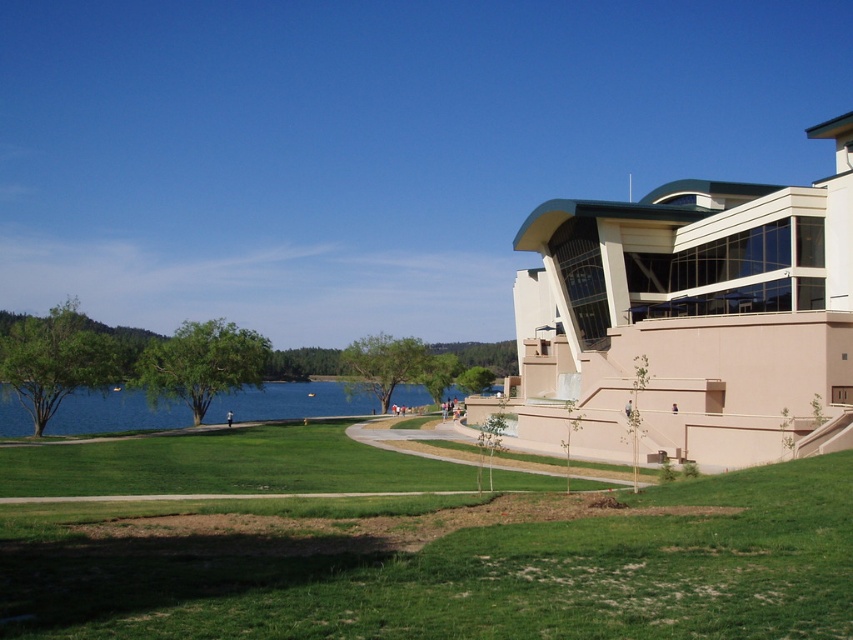
Is green grass at lower center to the left of blue water at center from the viewer's perspective?

No, green grass at lower center is not to the left of blue water at center.

Is green grass at lower center to the right of blue water at center from the viewer's perspective?

Indeed, green grass at lower center is positioned on the right side of blue water at center.

Find the location of `green grass at lower center`. green grass at lower center is located at coordinates (444, 563).

At what (x,y) coordinates should I click in order to perform the action: click on green grass at lower center. Please return your answer as a coordinate pair (x, y). The image size is (853, 640). Looking at the image, I should click on (444, 563).